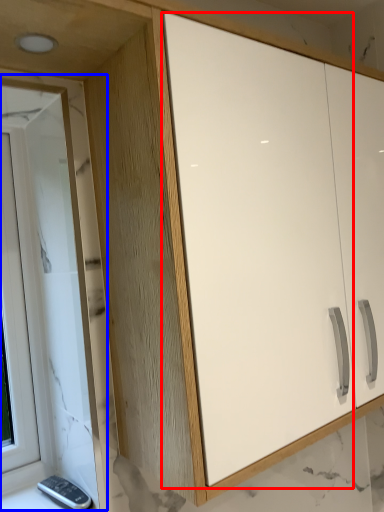
Question: Which object appears farthest to the camera in this image, screen door (highlighted by a red box) or window (highlighted by a blue box)?

Choices:
 (A) screen door
 (B) window

Answer: (B)